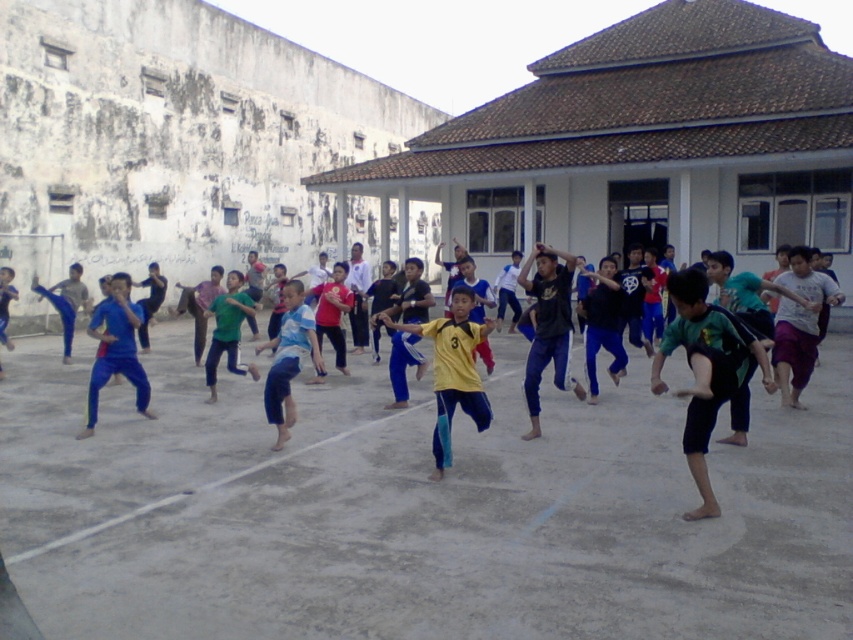
Who is more distant from viewer, [474,348] or [279,326]?

The point [279,326] is behind.

Is yellow jersey at center to the left of blue fabric pants at center from the viewer's perspective?

Incorrect, yellow jersey at center is not on the left side of blue fabric pants at center.

Is point (473, 419) positioned behind point (270, 387)?

No, it is not.

This screenshot has width=853, height=640. In order to click on yellow jersey at center in this screenshot , I will do `click(451, 371)`.

Image resolution: width=853 pixels, height=640 pixels. What are the coordinates of `yellow jersey at center` in the screenshot? It's located at (451, 371).

Between point (483, 397) and point (229, 346), which one is positioned in front?

Point (483, 397) is more forward.

Is point (454, 324) positioned after point (238, 374)?

No, (454, 324) is closer to viewer.

You are a GUI agent. You are given a task and a screenshot of the screen. Output one action in this format:
    pyautogui.click(x=<x>, y=<y>)
    Task: Click on the yellow jersey at center
    The height and width of the screenshot is (640, 853).
    Given the screenshot: What is the action you would take?
    pyautogui.click(x=451, y=371)

Is blue fabric pants at center smaller than green fabric pants at center?

No.

Who is more distant from viewer, (276, 348) or (212, 353)?

Positioned behind is point (276, 348).

Locate an element on the screen. The width and height of the screenshot is (853, 640). blue fabric pants at center is located at coordinates coord(288,358).